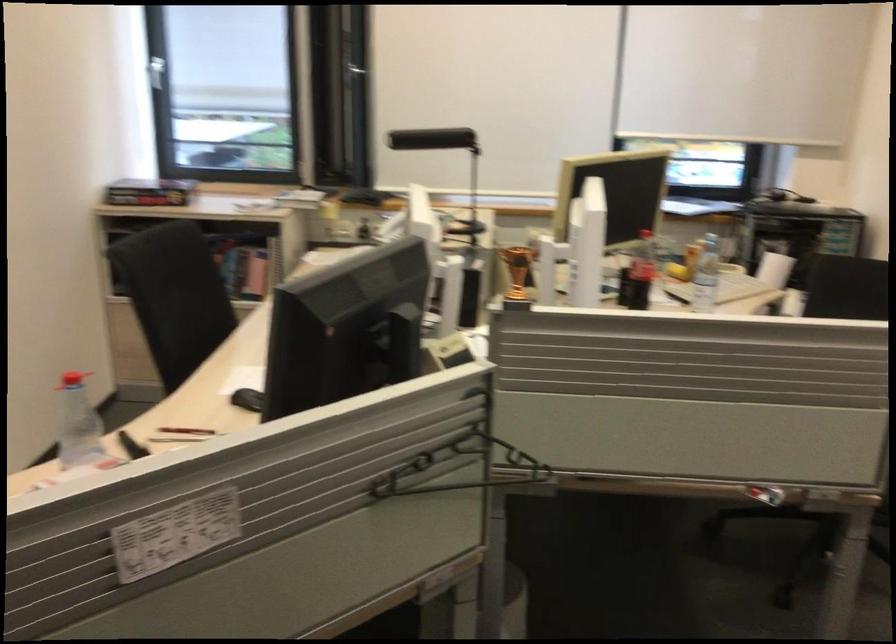
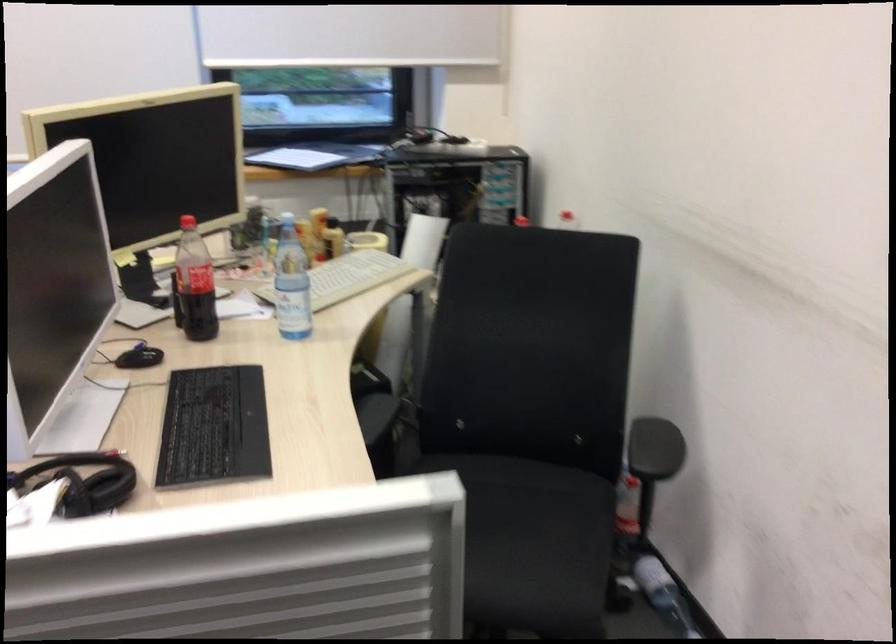
In the second image, find the point that corresponds to point (639, 269) in the first image.

(194, 283)